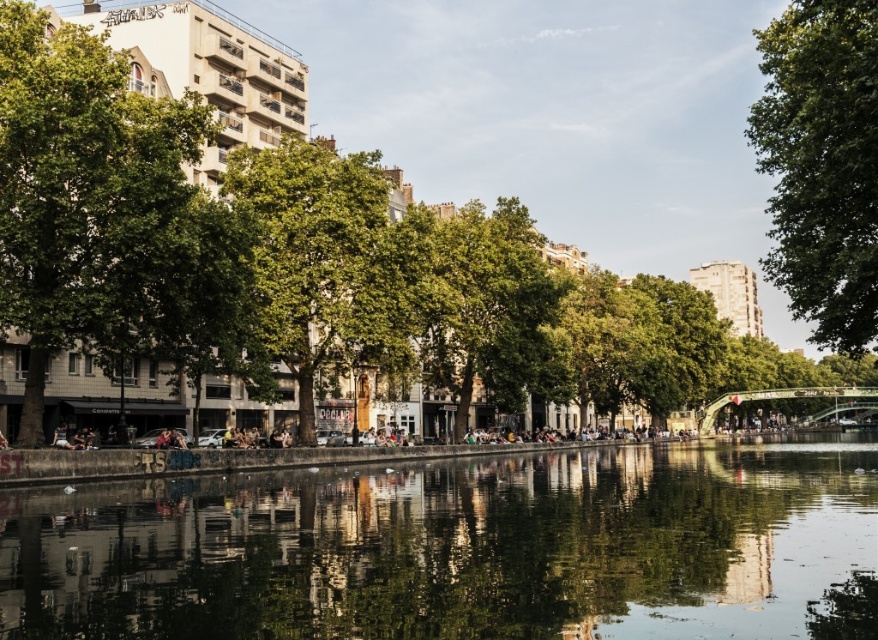
You are standing on the riverside path and see two green leafy trees. One is labeled as the green leafy tree at center and the other as the green leafy tree at upper right. Which tree would you need to walk towards if you want to reach the one that is to the right of the other?

The green leafy tree at upper right is to the right of the green leafy tree at center. Therefore, you should walk towards the green leafy tree at upper right to reach the one positioned to the right.

You are standing at the point marked as point (98, 208) in the image. What object are you facing?

The point (98, 208) corresponds to the green leafy tree at left, so you are facing the green leafy tree at left.

You are standing at the point marked by coordinates (821, 170) in the image. What object is exactly at this location?

The green leafy tree at center is located at point (821, 170).